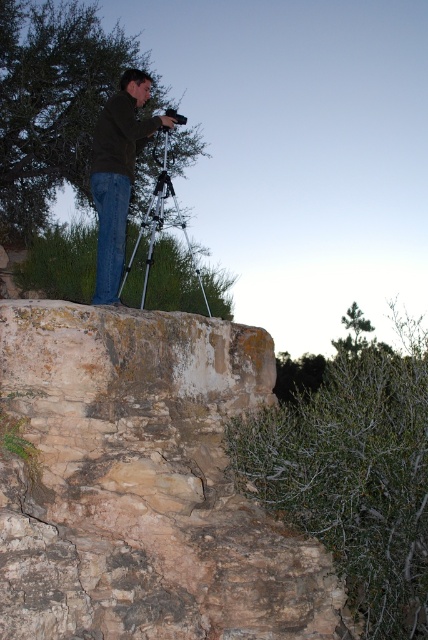
Question: Is rustic stone cliff at center closer to the viewer compared to dark brown leather jacket at center?

Choices:
 (A) yes
 (B) no

Answer: (A)

Question: Is dark brown leather jacket at center bigger than silver metallic tripod at center?

Choices:
 (A) no
 (B) yes

Answer: (A)

Question: Does rustic stone cliff at center have a lesser width compared to silver metallic tripod at center?

Choices:
 (A) yes
 (B) no

Answer: (B)

Question: Estimate the real-world distances between objects in this image. Which object is farther from the silver metallic tripod at center?

Choices:
 (A) dark brown leather jacket at center
 (B) rustic stone cliff at center

Answer: (B)

Question: Which point is farther to the camera?

Choices:
 (A) dark brown leather jacket at center
 (B) rustic stone cliff at center

Answer: (A)

Question: Among these points, which one is nearest to the camera?

Choices:
 (A) (148, 250)
 (B) (193, 513)

Answer: (B)